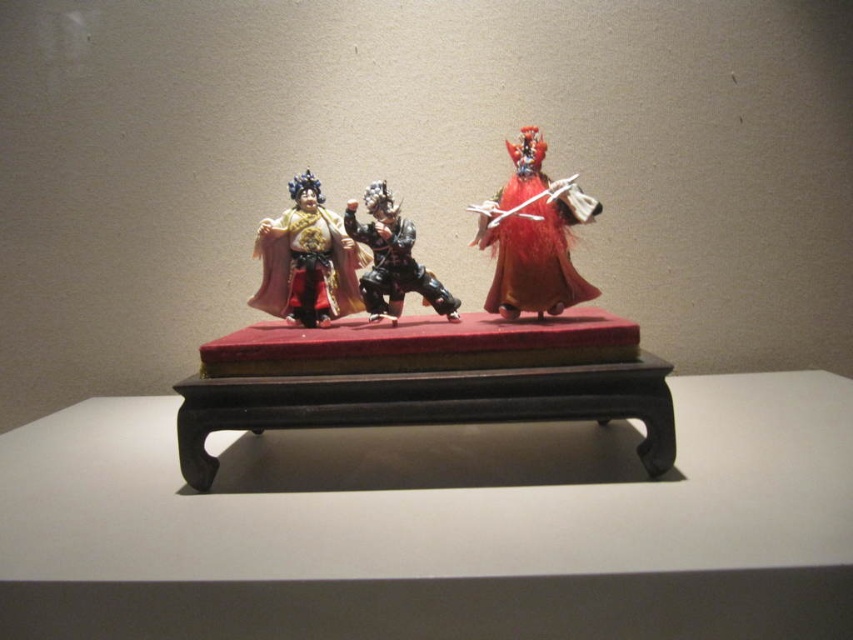
Can you confirm if dark brown wooden table at center is taller than black glossy figure at center?

Yes.

In the scene shown: Can you confirm if dark brown wooden table at center is smaller than black glossy figure at center?

Actually, dark brown wooden table at center might be larger than black glossy figure at center.

Which is behind, point (677, 490) or point (357, 234)?

Positioned behind is point (357, 234).

Where is `dark brown wooden table at center`? The image size is (853, 640). dark brown wooden table at center is located at coordinates (438, 525).

Between velvet-like red figure at center and matte gold fabric at center, which one appears on the right side from the viewer's perspective?

From the viewer's perspective, velvet-like red figure at center appears more on the right side.

Measure the distance between velvet-like red figure at center and matte gold fabric at center.

A distance of 31.23 centimeters exists between velvet-like red figure at center and matte gold fabric at center.

At what (x,y) coordinates should I click in order to perform the action: click on velvet-like red figure at center. Please return your answer as a coordinate pair (x, y). The height and width of the screenshot is (640, 853). Looking at the image, I should click on (532, 236).

This screenshot has width=853, height=640. Find the location of `velvet-like red figure at center`. velvet-like red figure at center is located at coordinates coord(532,236).

Can you confirm if wooden table at center is bigger than matte gold fabric at center?

Correct, wooden table at center is larger in size than matte gold fabric at center.

Who is more distant from viewer, (370,381) or (320,225)?

The point (320,225) is behind.

Between point (390, 403) and point (283, 248), which one is positioned behind?

The point (283, 248) is behind.

This screenshot has width=853, height=640. What are the coordinates of `wooden table at center` in the screenshot? It's located at (425, 380).